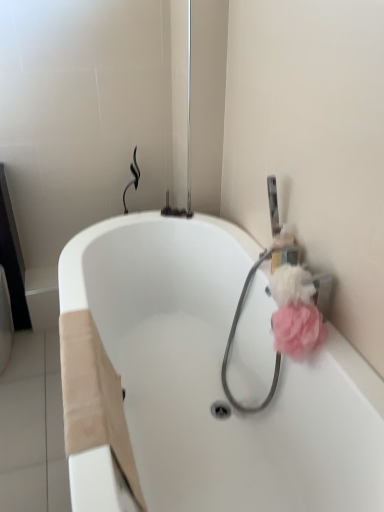
Question: Is point (324, 273) closer or farther from the camera than point (288, 324)?

Choices:
 (A) farther
 (B) closer

Answer: (A)

Question: From their relative heights in the image, would you say pink fabric garden hose at upper right is taller or shorter than pink fluffy sponge at right, the 1th flower ordered from the bottom?

Choices:
 (A) short
 (B) tall

Answer: (B)

Question: Considering the real-world distances, which object is farthest from the pink fluffy sponge at right, which appears as the 1th flower when viewed from the top?

Choices:
 (A) pink fluffy sponge at right, the 1th flower ordered from the bottom
 (B) pink fabric garden hose at upper right
 (C) white glossy bathtub at center

Answer: (C)

Question: Which of these objects is positioned closest to the white glossy bathtub at center?

Choices:
 (A) pink fabric garden hose at upper right
 (B) pink fluffy sponge at right, which appears as the 1th flower when viewed from the top
 (C) pink fluffy sponge at right, arranged as the 2th flower when viewed from the top

Answer: (A)